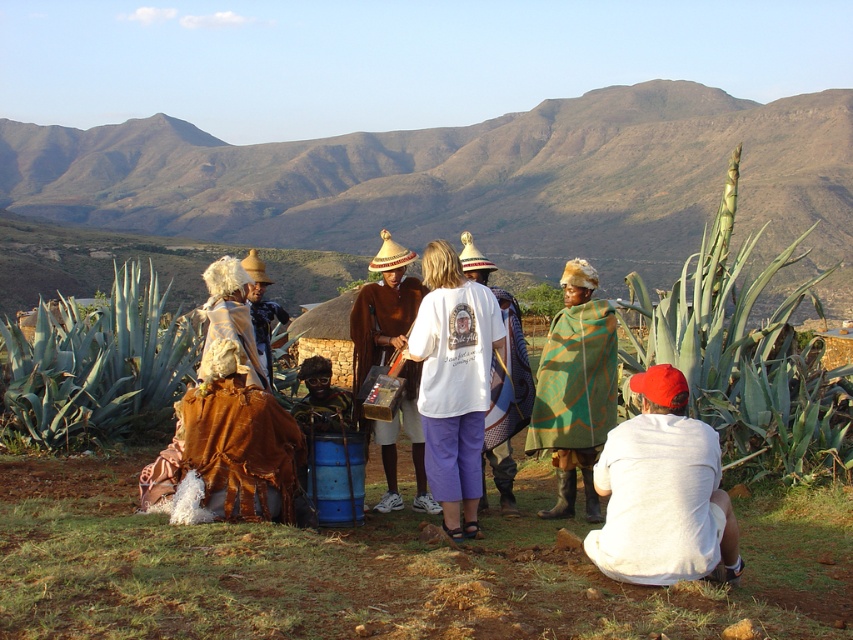
Question: Among these objects, which one is nearest to the camera?

Choices:
 (A) brown woven hat at center
 (B) white cotton t-shirt at center
 (C) rugged brown mountain at upper center

Answer: (B)

Question: Estimate the real-world distances between objects in this image. Which object is closer to the white cotton shirt at lower right?

Choices:
 (A) brown woven hat at center
 (B) rugged brown mountain at upper center

Answer: (A)

Question: Can you confirm if white cotton t-shirt at center is positioned above white cotton shirt at center?

Choices:
 (A) yes
 (B) no

Answer: (B)

Question: Is white cotton shirt at lower right below brown woven hat at center?

Choices:
 (A) no
 (B) yes

Answer: (B)

Question: Which of the following is the farthest from the observer?

Choices:
 (A) (566, 323)
 (B) (660, 451)
 (C) (654, 154)
 (D) (358, 385)

Answer: (C)

Question: Can you confirm if white cotton t-shirt at center is positioned to the right of green textured blanket at center?

Choices:
 (A) yes
 (B) no

Answer: (B)